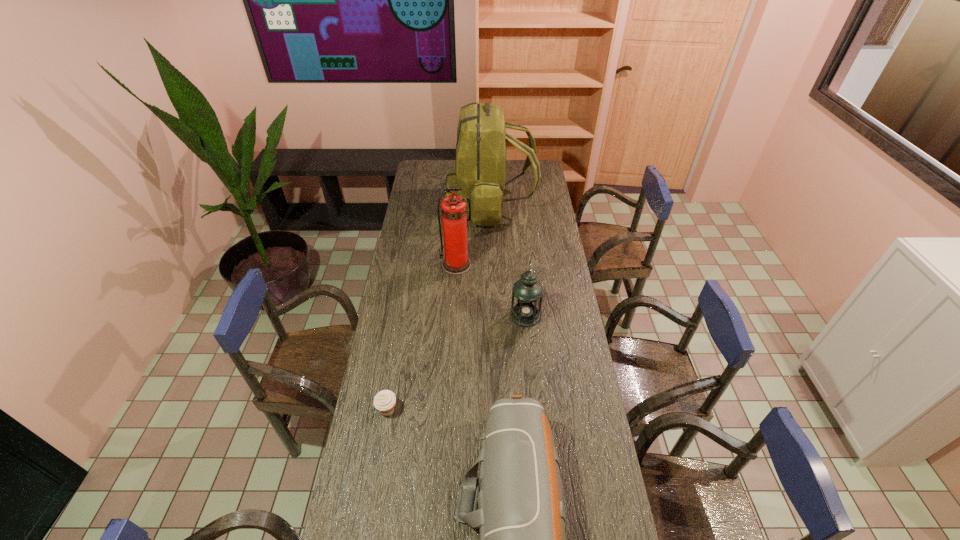
Where is `the farthest object`? the farthest object is located at coordinates (481, 145).

Identify the location of the tallest object. Image resolution: width=960 pixels, height=540 pixels. (481, 145).

Identify the location of fire extinguisher. (454, 219).

Locate an element on the screen. Image resolution: width=960 pixels, height=540 pixels. the fourth shortest object is located at coordinates (454, 219).

You are a GUI agent. You are given a task and a screenshot of the screen. Output one action in this format:
    pyautogui.click(x=<x>, y=<y>)
    Task: Click on the third nearest object
    This screenshot has width=960, height=540.
    Given the screenshot: What is the action you would take?
    pyautogui.click(x=527, y=293)

At what (x,y) coordinates should I click in order to perform the action: click on the third tallest object. Please return your answer as a coordinate pair (x, y). This screenshot has height=540, width=960. Looking at the image, I should click on (527, 293).

Where is `the leftmost object`? the leftmost object is located at coordinates (384, 401).

The height and width of the screenshot is (540, 960). In order to click on muffin in this screenshot , I will do `click(384, 401)`.

Where is `vacant space located on the front-facing side of the backpack`? The image size is (960, 540). vacant space located on the front-facing side of the backpack is located at coordinates (416, 204).

Locate an element on the screen. The width and height of the screenshot is (960, 540). vacant position located 0.100m on the front-facing side of the backpack is located at coordinates (426, 204).